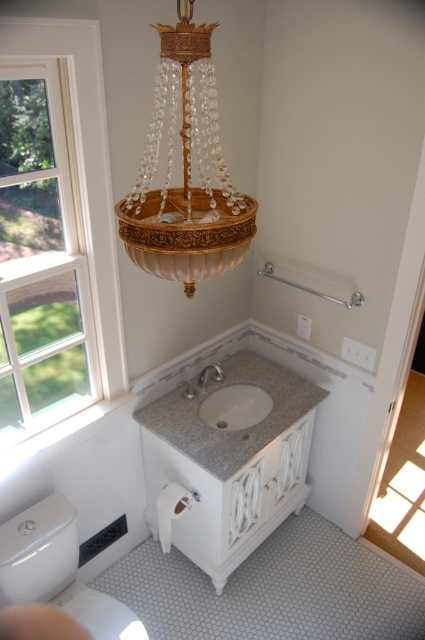
Between point (204, 417) and point (212, 368), which one is positioned in front?

Positioned in front is point (204, 417).

Is point (217, 378) in front of point (207, 376)?

No, (217, 378) is further to viewer.

The width and height of the screenshot is (425, 640). I want to click on white granite sink at center, so click(235, 406).

Can you confirm if gold crystal chandelier at upper center is shorter than white glossy toilet bowl at lower left?

No, gold crystal chandelier at upper center is not shorter than white glossy toilet bowl at lower left.

How far apart are gold crystal chandelier at upper center and white glossy toilet bowl at lower left?

The distance of gold crystal chandelier at upper center from white glossy toilet bowl at lower left is 1.23 meters.

Is point (201, 129) closer to viewer compared to point (76, 598)?

Yes, point (201, 129) is in front of point (76, 598).

I want to click on gold crystal chandelier at upper center, so click(186, 172).

Which of these two, white glossy toilet bowl at lower left or white granite sink at center, stands shorter?

white granite sink at center is shorter.

Is white glossy toilet bowl at lower left closer to the viewer compared to white granite sink at center?

Yes, it is in front of white granite sink at center.

Between point (74, 515) and point (206, 376), which one is positioned in front?

Point (74, 515) is in front.

Locate an element on the screen. white glossy toilet bowl at lower left is located at coordinates (57, 570).